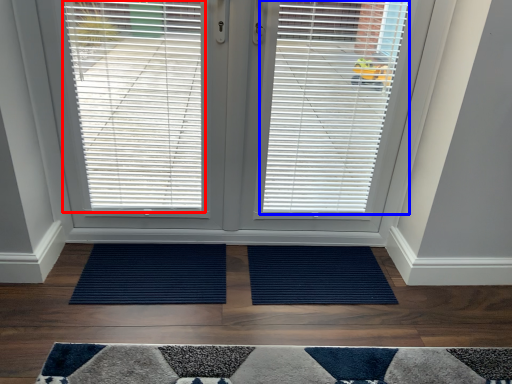
Question: Which object appears closest to the camera in this image, window blind (highlighted by a red box) or window blind (highlighted by a blue box)?

Choices:
 (A) window blind
 (B) window blind

Answer: (A)